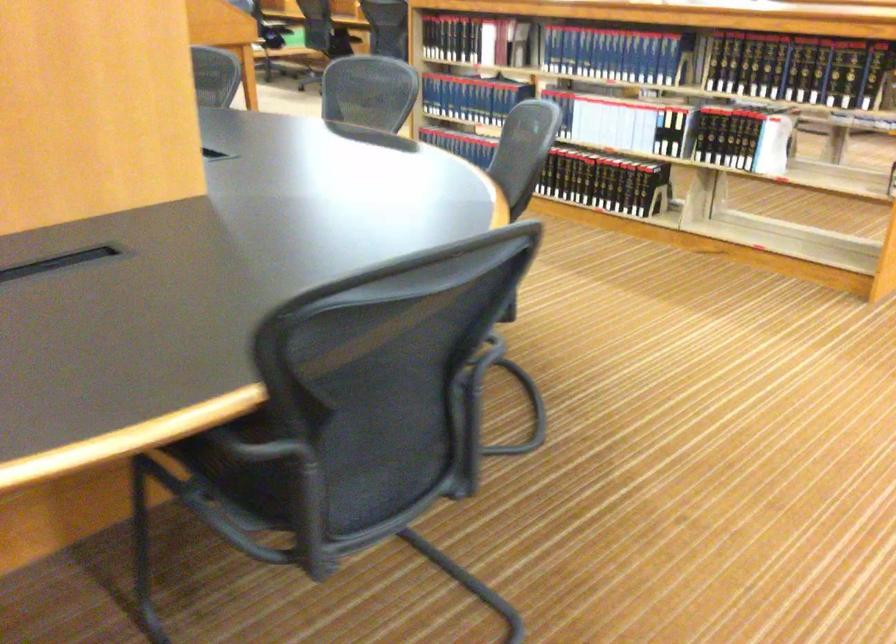
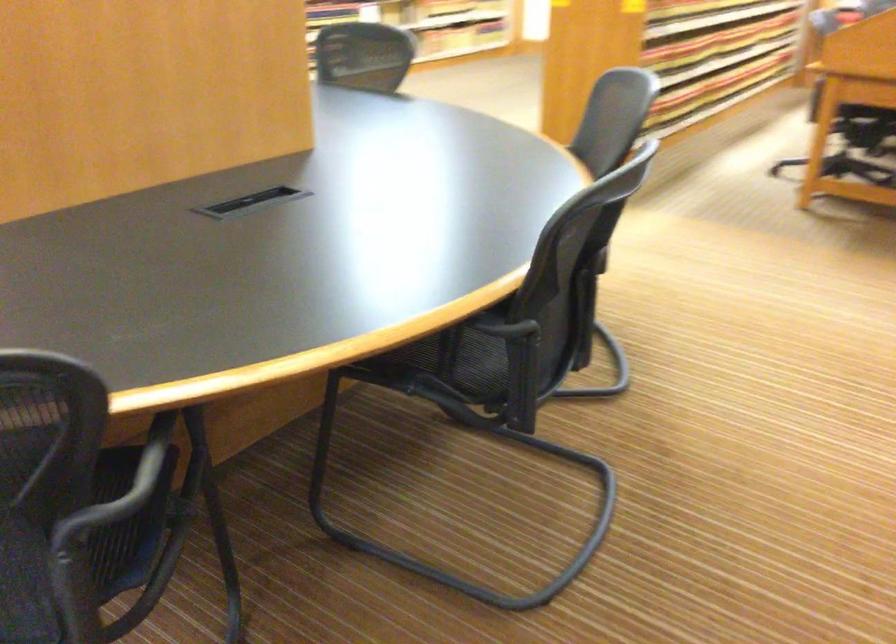
Locate, in the second image, the point that corresponds to point (478, 175) in the first image.

(151, 460)